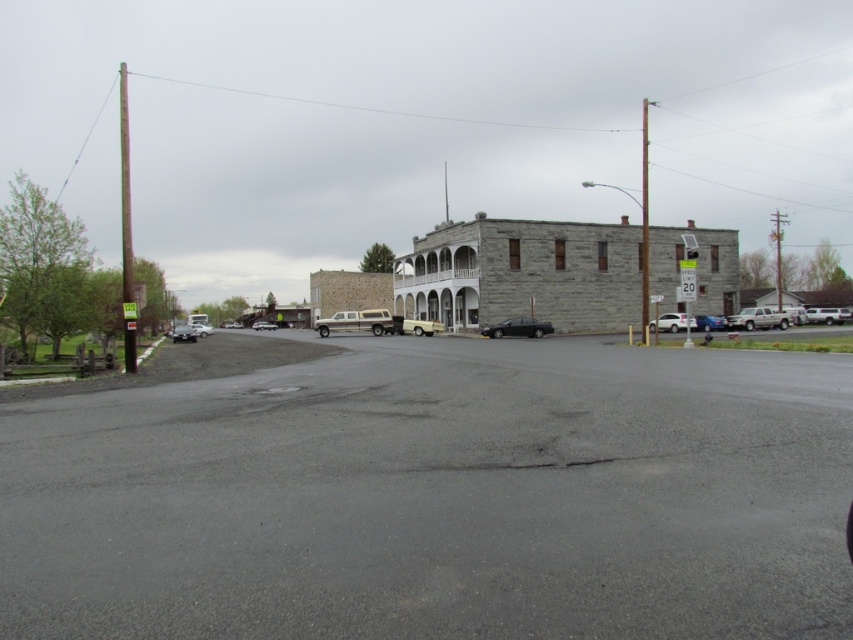
Does gray stone building at center have a larger size compared to white matte truck at center?

Correct, gray stone building at center is larger in size than white matte truck at center.

What do you see at coordinates (521, 273) in the screenshot?
I see `gray stone building at center` at bounding box center [521, 273].

This screenshot has height=640, width=853. I want to click on gray stone building at center, so click(521, 273).

Which of these two, metallic silver car at lower left or metallic silver sedan at center, stands taller?

metallic silver sedan at center is taller.

Does metallic silver car at lower left have a larger size compared to metallic silver sedan at center?

Incorrect, metallic silver car at lower left is not larger than metallic silver sedan at center.

Measure the distance between point (178, 336) and camera.

Point (178, 336) is 58.08 meters from camera.

At what (x,y) coordinates should I click in order to perform the action: click on metallic silver car at lower left. Please return your answer as a coordinate pair (x, y). Image resolution: width=853 pixels, height=640 pixels. Looking at the image, I should click on (183, 333).

Does asphalt at center have a lesser height compared to shiny black sedan at center?

Correct, asphalt at center is not as tall as shiny black sedan at center.

Is asphalt at center thinner than shiny black sedan at center?

No.

Is point (407, 493) positioned behind point (531, 326)?

No, it is not.

The height and width of the screenshot is (640, 853). What are the coordinates of `asphalt at center` in the screenshot? It's located at (438, 499).